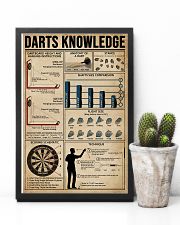
You are a GUI agent. You are given a task and a screenshot of the screen. Output one action in this format:
    pyautogui.click(x=<x>, y=<y>)
    Task: Click on the white wall
    This screenshot has width=180, height=225.
    Given the screenshot: What is the action you would take?
    pyautogui.click(x=149, y=71)